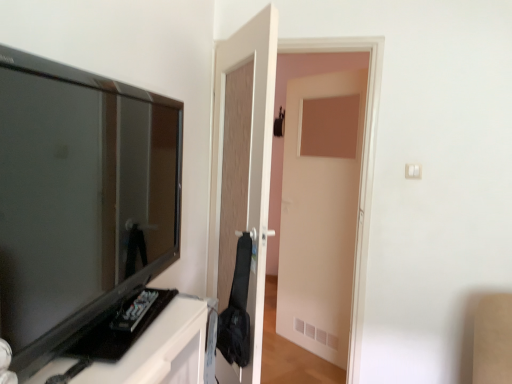
What is the approximate height of matte black tv at left?

matte black tv at left is 65.98 centimeters tall.

Identify the location of matte black tv at left. The width and height of the screenshot is (512, 384). (79, 199).

What do you see at coordinates (79, 199) in the screenshot? The width and height of the screenshot is (512, 384). I see `matte black tv at left` at bounding box center [79, 199].

Measure the distance between wooden door at center and camera.

wooden door at center and camera are 1.62 meters apart.

What is the approximate width of wooden door at center?

wooden door at center is 6.57 inches wide.

Identify the location of wooden door at center. This screenshot has width=512, height=384. (245, 167).

Describe the element at coordinates (245, 167) in the screenshot. Image resolution: width=512 pixels, height=384 pixels. I see `wooden door at center` at that location.

The image size is (512, 384). I want to click on matte black tv at left, so click(79, 199).

Is wooden door at center to the right of matte black tv at left from the viewer's perspective?

Correct, you'll find wooden door at center to the right of matte black tv at left.

Which object is more forward, wooden door at center or matte black tv at left?

matte black tv at left is closer to the camera.

Does point (220, 159) come behind point (72, 306)?

Yes, it is.

From the image's perspective, which one is positioned lower, wooden door at center or matte black tv at left?

wooden door at center appears lower in the image.

Consider the image. From a real-world perspective, is wooden door at center positioned under matte black tv at left based on gravity?

Yes, from a real-world perspective, wooden door at center is beneath matte black tv at left.

Can you confirm if wooden door at center is thinner than matte black tv at left?

No, wooden door at center is not thinner than matte black tv at left.

Which of these two, wooden door at center or matte black tv at left, stands shorter?

matte black tv at left is shorter.

Between wooden door at center and matte black tv at left, which one has larger size?

wooden door at center.

Would you say wooden door at center contains matte black tv at left?

Actually, matte black tv at left is outside wooden door at center.

Based on the photo, is wooden door at center far from matte black tv at left?

That's not correct — wooden door at center is a little close to matte black tv at left.

Could you tell me if wooden door at center is facing matte black tv at left?

No, wooden door at center does not turn towards matte black tv at left.

From the picture: How different are the orientations of wooden door at center and matte black tv at left in degrees?

26.3 degrees separate the facing orientations of wooden door at center and matte black tv at left.

Locate an element on the screen. Image resolution: width=512 pixels, height=384 pixels. door behind the matte black tv at left is located at coordinates (245, 167).

Would you say matte black tv at left is to the left or to the right of wooden door at center in the picture?

Based on their positions, matte black tv at left is located to the left of wooden door at center.

Which object is closer to the camera taking this photo, matte black tv at left or wooden door at center?

matte black tv at left is more forward.

Does point (55, 248) come in front of point (252, 147)?

Yes, point (55, 248) is closer to viewer.

In the scene shown: From the image's perspective, is matte black tv at left below wooden door at center?

Actually, matte black tv at left appears above wooden door at center in the image.

From a real-world perspective, does matte black tv at left stand above wooden door at center?

Yes, from a real-world perspective, matte black tv at left is above wooden door at center.

Is matte black tv at left wider than wooden door at center?

No.

Considering the relative sizes of matte black tv at left and wooden door at center in the image provided, is matte black tv at left taller than wooden door at center?

In fact, matte black tv at left may be shorter than wooden door at center.

Based on their sizes in the image, would you say matte black tv at left is bigger or smaller than wooden door at center?

matte black tv at left is smaller than wooden door at center.

Based on the photo, is wooden door at center a part of matte black tv at left?

Definitely not — wooden door at center is not inside matte black tv at left.

Are matte black tv at left and wooden door at center making contact?

No, matte black tv at left is not in contact with wooden door at center.

Is matte black tv at left facing towards wooden door at center?

No.

How much distance is there between matte black tv at left and wooden door at center?

matte black tv at left and wooden door at center are 27.16 inches apart from each other.

The width and height of the screenshot is (512, 384). Identify the location of television on the left of wooden door at center. (79, 199).

Where is `television in front of the wooden door at center`? television in front of the wooden door at center is located at coordinates (79, 199).

Where is `door that is under the matte black tv at left (from a real-world perspective)`? door that is under the matte black tv at left (from a real-world perspective) is located at coordinates (245, 167).